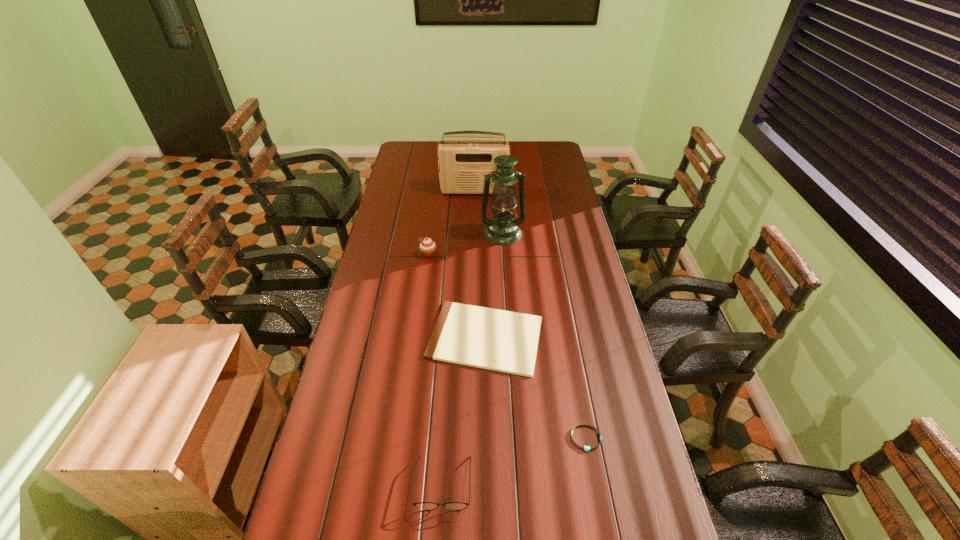
Locate an element on the screen. The image size is (960, 540). the third nearest object is located at coordinates (498, 340).

Where is `vacant space located on the back of the oil lamp`? The image size is (960, 540). vacant space located on the back of the oil lamp is located at coordinates coord(499,184).

The height and width of the screenshot is (540, 960). I want to click on free space located on the front-facing side of the radio receiver, so click(x=473, y=215).

Where is `free space located on the left of the fourth shortest object`? The height and width of the screenshot is (540, 960). free space located on the left of the fourth shortest object is located at coordinates coord(403,254).

Where is `free space located 0.100m on the buckle of the fifth farthest object`? free space located 0.100m on the buckle of the fifth farthest object is located at coordinates (595, 489).

Locate an element on the screen. blank space located on the back of the clipboard is located at coordinates (485, 271).

Identify the location of object at the right edge. The height and width of the screenshot is (540, 960). (587, 448).

This screenshot has width=960, height=540. In the image, there is a desktop. Find the location of `free space at the far edge`. free space at the far edge is located at coordinates (436, 151).

In order to click on vacant space at the left edge in this screenshot , I will do `click(372, 364)`.

In the image, there is a desktop. Where is `free space at the right edge`? free space at the right edge is located at coordinates (573, 261).